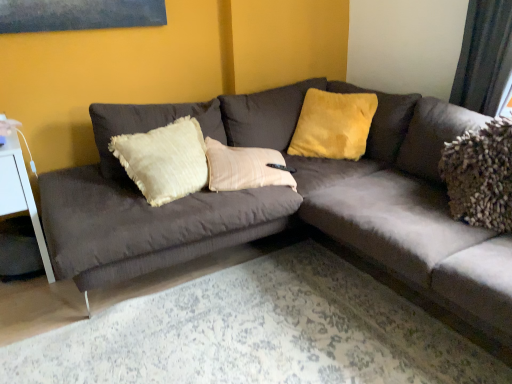
Question: Is white glossy side table at left thinner than suede-like dark gray couch at center?

Choices:
 (A) yes
 (B) no

Answer: (A)

Question: Is white glossy side table at left surrounding suede-like dark gray couch at center?

Choices:
 (A) no
 (B) yes

Answer: (A)

Question: From a real-world perspective, is white glossy side table at left below suede-like dark gray couch at center?

Choices:
 (A) no
 (B) yes

Answer: (B)

Question: From the image's perspective, is white glossy side table at left beneath suede-like dark gray couch at center?

Choices:
 (A) no
 (B) yes

Answer: (B)

Question: Is white glossy side table at left aimed at suede-like dark gray couch at center?

Choices:
 (A) yes
 (B) no

Answer: (B)

Question: Is point (23, 173) closer or farther from the camera than point (305, 115)?

Choices:
 (A) closer
 (B) farther

Answer: (A)

Question: From the image's perspective, is white glossy side table at left located above or below velvet yellow pillow at upper center?

Choices:
 (A) below
 (B) above

Answer: (A)

Question: Is white glossy side table at left wider or thinner than velvet yellow pillow at upper center?

Choices:
 (A) wide
 (B) thin

Answer: (A)

Question: Based on their sizes in the image, would you say white glossy side table at left is bigger or smaller than velvet yellow pillow at upper center?

Choices:
 (A) big
 (B) small

Answer: (A)

Question: Based on their positions, is velvet yellow pillow at upper center located to the left or right of suede-like dark gray couch at center?

Choices:
 (A) left
 (B) right

Answer: (B)

Question: Is velvet yellow pillow at upper center in front of or behind suede-like dark gray couch at center in the image?

Choices:
 (A) behind
 (B) front

Answer: (A)

Question: Is velvet yellow pillow at upper center taller or shorter than suede-like dark gray couch at center?

Choices:
 (A) tall
 (B) short

Answer: (B)

Question: From the image's perspective, is velvet yellow pillow at upper center above or below suede-like dark gray couch at center?

Choices:
 (A) above
 (B) below

Answer: (A)

Question: From their relative heights in the image, would you say velvet yellow pillow at upper center is taller or shorter than white glossy side table at left?

Choices:
 (A) tall
 (B) short

Answer: (B)

Question: In the image, is velvet yellow pillow at upper center positioned in front of or behind white glossy side table at left?

Choices:
 (A) behind
 (B) front

Answer: (A)